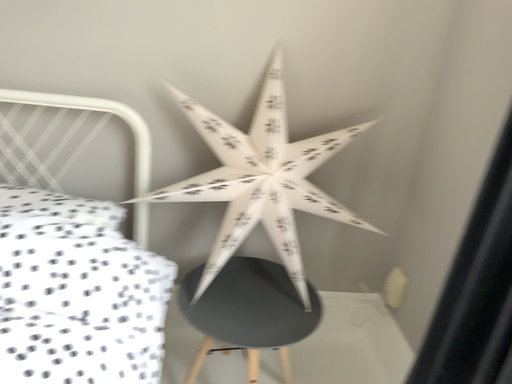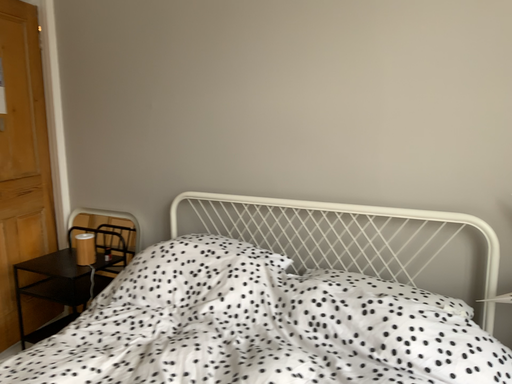
Question: Which way did the camera rotate in the video?

Choices:
 (A) rotated upward
 (B) rotated downward

Answer: (A)